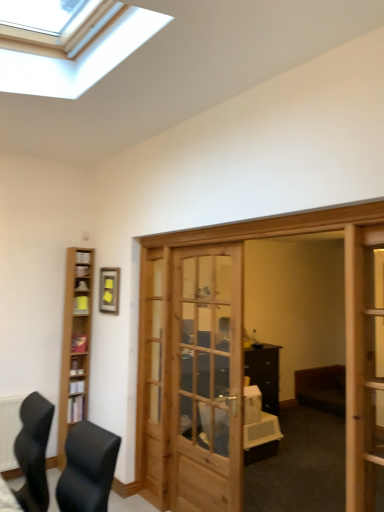
Question: Considering the positions of point (72, 423) and point (74, 302), is point (72, 423) closer or farther from the camera than point (74, 302)?

Choices:
 (A) closer
 (B) farther

Answer: (A)

Question: Would you say light brown wood bookshelf at left is inside or outside yellow paper at left, the 2th shelf positioned from the front?

Choices:
 (A) outside
 (B) inside

Answer: (A)

Question: Which object is positioned farthest from the wooden screen door at right?

Choices:
 (A) yellow matte picture frame at upper left
 (B) yellow paper at left, the 2th shelf positioned from the front
 (C) black leather chair at lower left
 (D) wooden bookshelf at lower left, arranged as the 2th shelf when viewed from the top
 (E) light brown wood bookshelf at left

Answer: (D)

Question: Which is nearer to the black leather chair at lower left?

Choices:
 (A) wooden screen door at right
 (B) light brown wood bookshelf at left
 (C) wooden bookshelf at lower left, the first shelf when ordered from bottom to top
 (D) yellow matte picture frame at upper left
 (E) yellow paper at left, placed as the first shelf when sorted from top to bottom

Answer: (B)